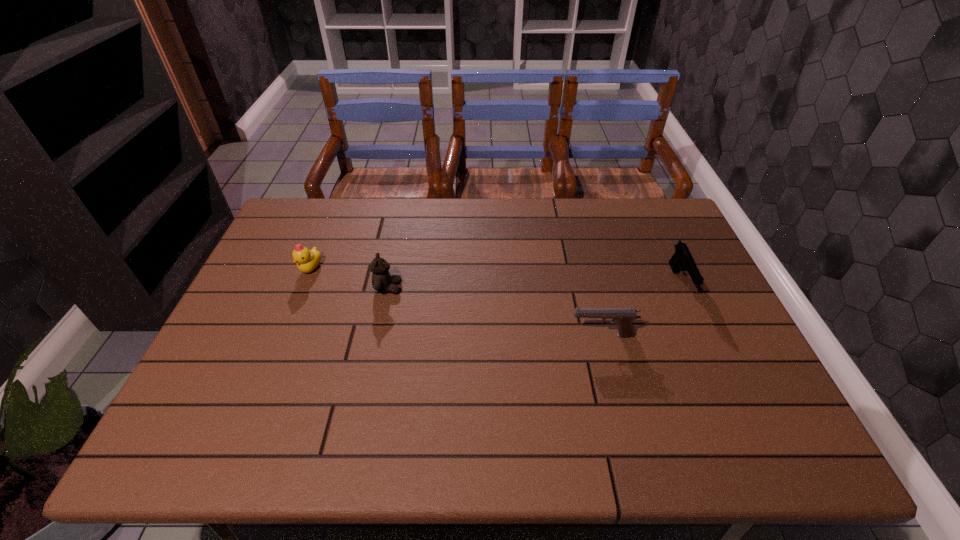
I want to click on the second object from left to right, so point(382,281).

This screenshot has height=540, width=960. Find the location of `the third object from left to right`. the third object from left to right is located at coordinates (623, 317).

This screenshot has height=540, width=960. Find the location of `the nearest object`. the nearest object is located at coordinates (623, 317).

This screenshot has width=960, height=540. I want to click on the farther pistol, so click(682, 259).

At what (x,y) coordinates should I click in order to perform the action: click on the rightmost object. Please return your answer as a coordinate pair (x, y). Looking at the image, I should click on (682, 259).

This screenshot has height=540, width=960. Find the location of `duckling`. duckling is located at coordinates (307, 261).

Identify the location of vacant region located on the face of the teddy bear. (422, 288).

I want to click on free space located 0.400m at the barrel of the nearer pistol, so click(415, 335).

Image resolution: width=960 pixels, height=540 pixels. In order to click on vacant region located at the barrel of the nearer pistol in this screenshot , I will do `click(426, 335)`.

The height and width of the screenshot is (540, 960). I want to click on vacant space located 0.380m at the barrel of the nearer pistol, so click(422, 335).